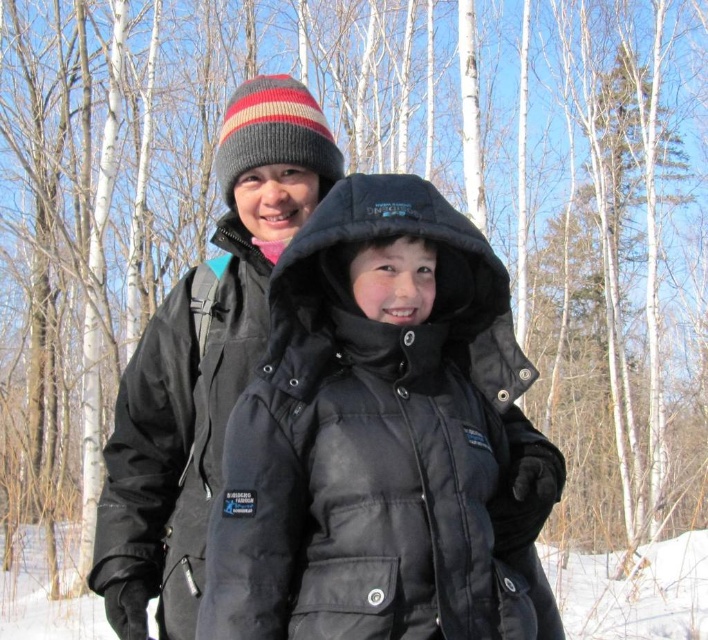
Question: Which of the following is the closest to the observer?

Choices:
 (A) white fluffy snow at lower center
 (B) black softshell jacket at upper center

Answer: (B)

Question: Observing the image, what is the correct spatial positioning of matte black jacket at center in reference to black softshell jacket at upper center?

Choices:
 (A) above
 (B) below

Answer: (A)

Question: Does matte black jacket at center have a larger size compared to white fluffy snow at lower center?

Choices:
 (A) no
 (B) yes

Answer: (A)

Question: Which object appears closest to the camera in this image?

Choices:
 (A) white fluffy snow at lower center
 (B) matte black jacket at center
 (C) black softshell jacket at upper center

Answer: (B)

Question: Does black softshell jacket at upper center have a lesser width compared to white fluffy snow at lower center?

Choices:
 (A) no
 (B) yes

Answer: (B)

Question: Which object is positioned closest to the matte black jacket at center?

Choices:
 (A) white fluffy snow at lower center
 (B) black softshell jacket at upper center

Answer: (B)